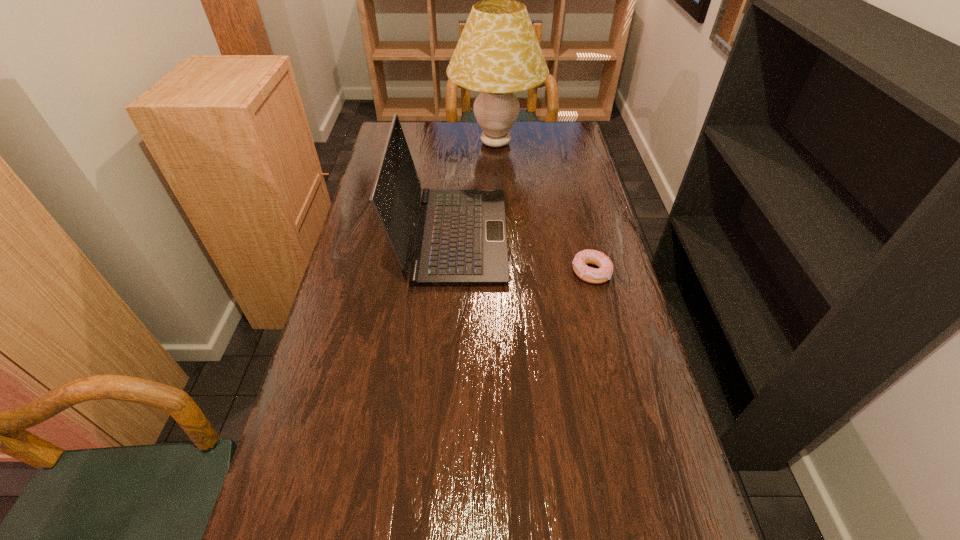
The image size is (960, 540). What are the coordinates of `lampshade present at the right edge` in the screenshot? It's located at click(x=498, y=54).

Locate an element on the screen. The height and width of the screenshot is (540, 960). doughnut that is positioned at the right edge is located at coordinates (602, 274).

Identify the location of object that is at the far right corner. (498, 54).

You are a GUI agent. You are given a task and a screenshot of the screen. Output one action in this format:
    pyautogui.click(x=<x>, y=<y>)
    Task: Click on the vacant space at the far edge of the desktop
    
    Given the screenshot: What is the action you would take?
    pyautogui.click(x=437, y=133)

The height and width of the screenshot is (540, 960). In the image, there is a desktop. What are the coordinates of `free space at the left edge` in the screenshot? It's located at (357, 272).

Find the location of a particular element. The image size is (960, 540). free space at the right edge of the desktop is located at coordinates (589, 364).

You are a GUI agent. You are given a task and a screenshot of the screen. Output one action in this format:
    pyautogui.click(x=<x>, y=<y>)
    Task: Click on the vacant space at the far left corner of the desktop
    This screenshot has height=540, width=960.
    Given the screenshot: What is the action you would take?
    pyautogui.click(x=415, y=152)

Find the location of a particular element. free space at the far right corner is located at coordinates (566, 148).

Locate an element on the screen. The image size is (960, 540). free spot between the rightmost object and the laptop computer is located at coordinates coord(521,254).

Find the location of a particular element. The image size is (960, 540). free point between the doughnut and the second shortest object is located at coordinates (521, 254).